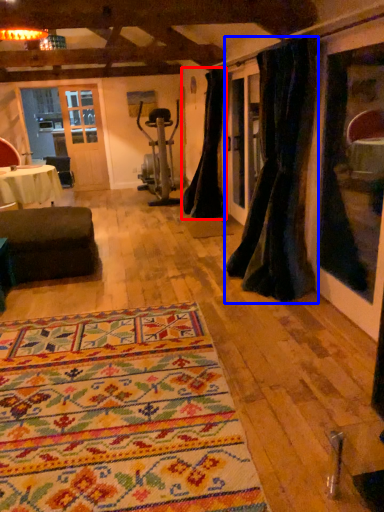
Question: Which point is closer to the camera, curtain (highlighted by a red box) or curtain (highlighted by a blue box)?

Choices:
 (A) curtain
 (B) curtain

Answer: (B)